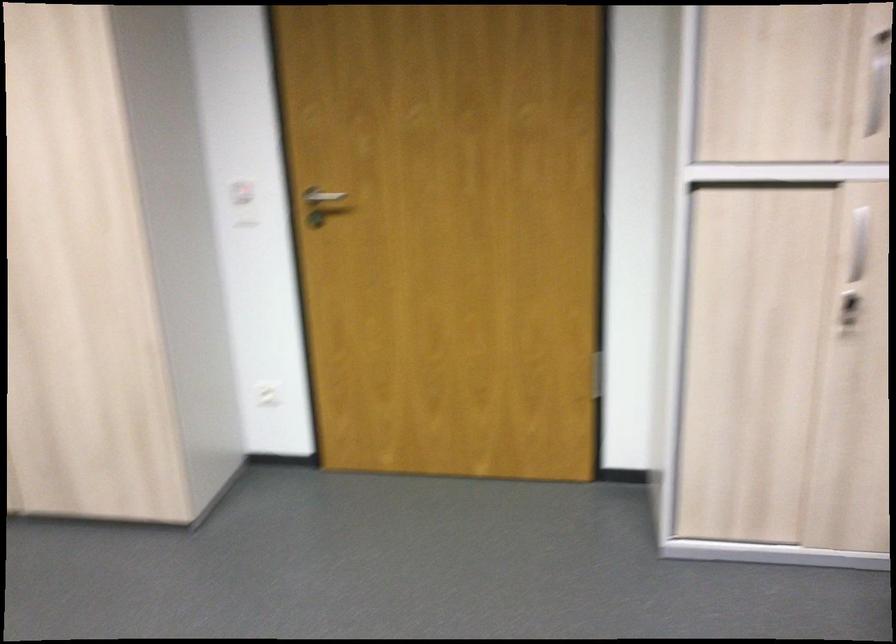
Find the location of a particular element. This screenshot has height=644, width=896. metal locker handle is located at coordinates (321, 204).